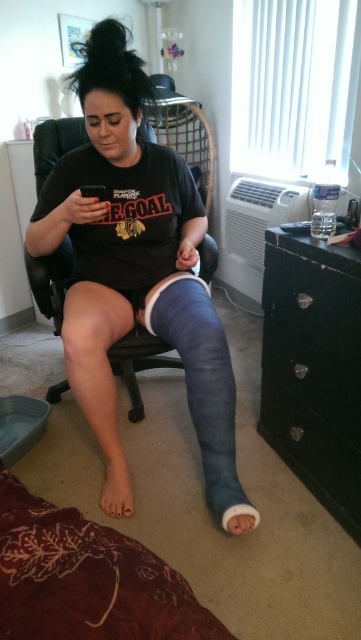
Question: Considering the real-world distances, which object is closest to the white matte cast at lower center?

Choices:
 (A) black glossy dresser at lower right
 (B) blue cast at lower left

Answer: (A)

Question: Observing the image, what is the correct spatial positioning of blue cast at lower left in reference to smooth white cast at lower left?

Choices:
 (A) above
 (B) below

Answer: (A)

Question: Which of the following is the farthest from the observer?

Choices:
 (A) black glossy dresser at lower right
 (B) blue cast at lower left
 (C) smooth white cast at lower left
 (D) white matte cast at lower center

Answer: (C)

Question: From the image, what is the correct spatial relationship of blue cast at lower left in relation to white matte cast at lower center?

Choices:
 (A) above
 (B) below

Answer: (A)

Question: Does black glossy dresser at lower right have a greater width compared to white matte cast at lower center?

Choices:
 (A) yes
 (B) no

Answer: (A)

Question: Estimate the real-world distances between objects in this image. Which object is closer to the blue cast at lower left?

Choices:
 (A) white matte cast at lower center
 (B) smooth white cast at lower left

Answer: (B)